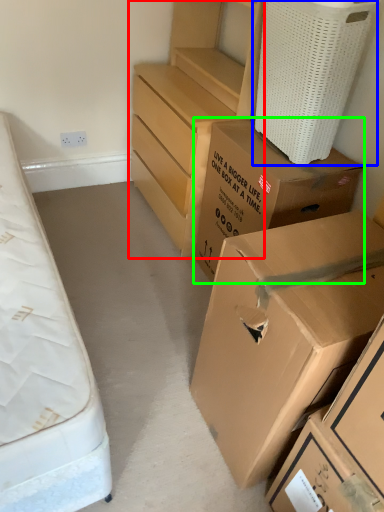
Question: Which is farther away from chest of drawers (highlighted by a red box)? laundry basket (highlighted by a blue box) or box (highlighted by a green box)?

Choices:
 (A) laundry basket
 (B) box

Answer: (A)